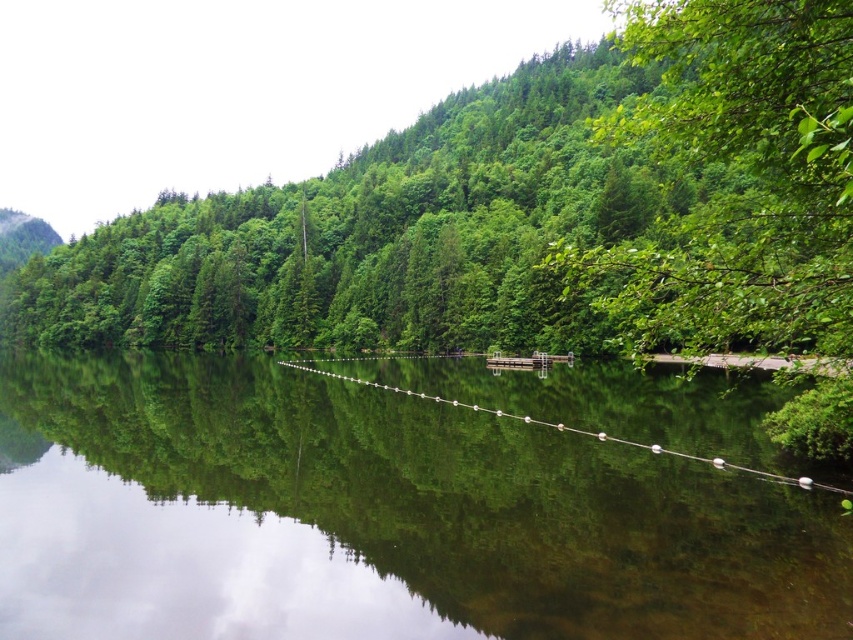
Question: Estimate the real-world distances between objects in this image. Which object is farther from the green leafy tree at right?

Choices:
 (A) green leafy tree at center
 (B) clear water at center

Answer: (A)

Question: Is clear water at center wider than green leafy tree at right?

Choices:
 (A) no
 (B) yes

Answer: (B)

Question: Does green leafy tree at center have a larger size compared to green leafy tree at right?

Choices:
 (A) no
 (B) yes

Answer: (B)

Question: Based on their relative distances, which object is farther from the clear water at center?

Choices:
 (A) green leafy tree at right
 (B) green leafy tree at center

Answer: (B)

Question: Estimate the real-world distances between objects in this image. Which object is closer to the green leafy tree at right?

Choices:
 (A) green leafy tree at center
 (B) clear water at center

Answer: (B)

Question: Is the position of green leafy tree at center less distant than that of green leafy tree at right?

Choices:
 (A) no
 (B) yes

Answer: (A)